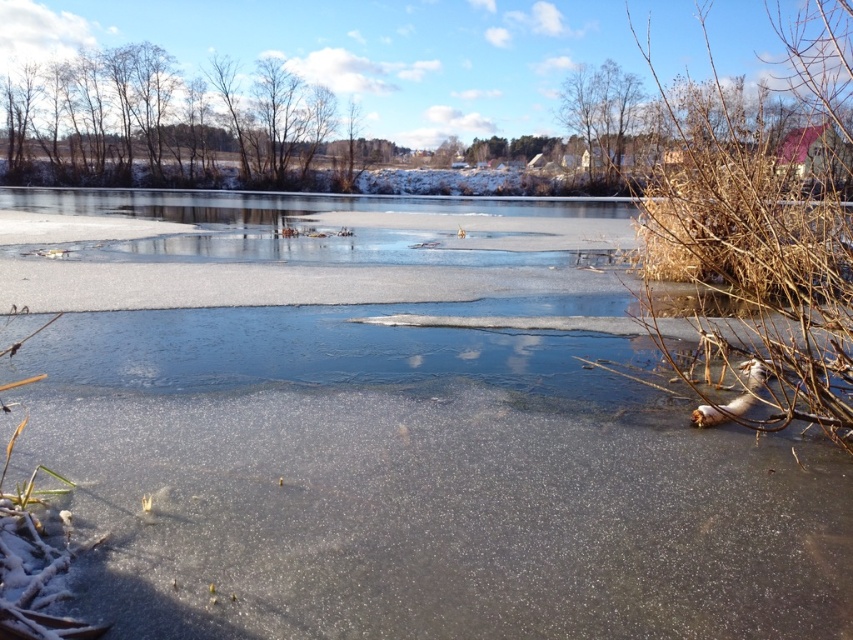
Question: Which object appears farthest from the camera in this image?

Choices:
 (A) brown dry branches at right
 (B) bare branches at left

Answer: (B)

Question: Does brown dry branches at right have a smaller size compared to bare branches at left?

Choices:
 (A) yes
 (B) no

Answer: (B)

Question: Which point is farther to the camera?

Choices:
 (A) bare branches at left
 (B) brown dry branches at right

Answer: (A)

Question: Is brown dry branches at right to the right of bare branches at left from the viewer's perspective?

Choices:
 (A) yes
 (B) no

Answer: (A)

Question: Which point is closer to the camera taking this photo?

Choices:
 (A) (822, 381)
 (B) (126, 104)

Answer: (A)

Question: Is brown dry branches at right closer to camera compared to bare branches at left?

Choices:
 (A) no
 (B) yes

Answer: (B)